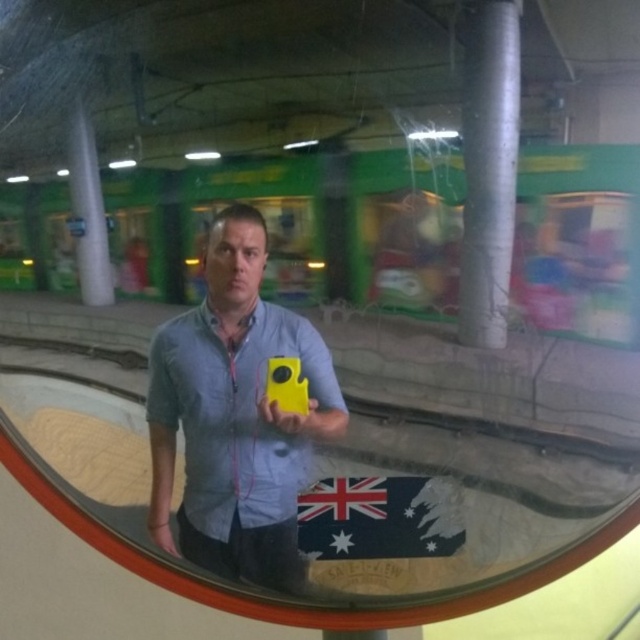
Question: Which of the following is the closest to the observer?

Choices:
 (A) matte yellow camera at center
 (B) dark green fabric flag at center

Answer: (A)

Question: Does matte yellow camera at center lie in front of dark green fabric flag at center?

Choices:
 (A) yes
 (B) no

Answer: (A)

Question: From the image, what is the correct spatial relationship of matte yellow camera at center in relation to dark green fabric flag at center?

Choices:
 (A) above
 (B) below

Answer: (A)

Question: Is matte yellow camera at center smaller than dark green fabric flag at center?

Choices:
 (A) yes
 (B) no

Answer: (B)